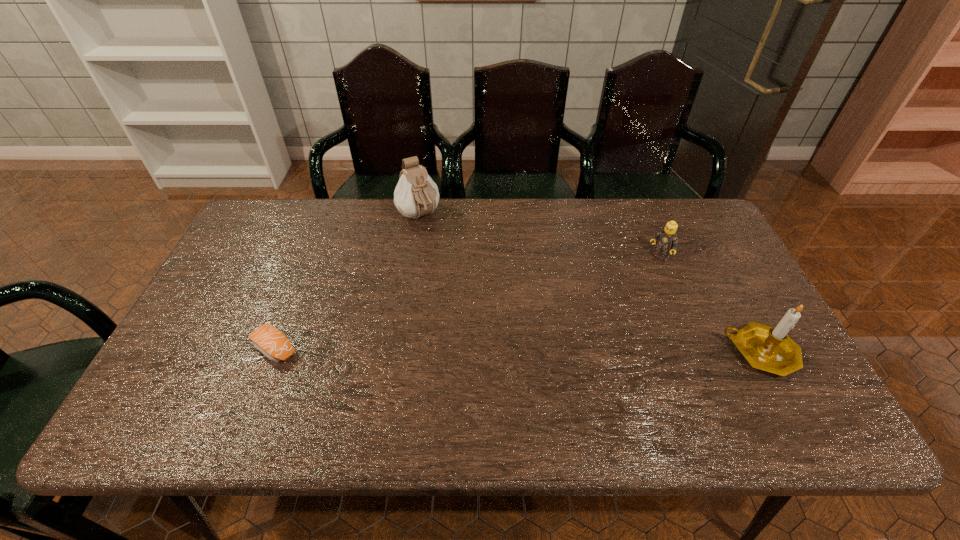
Locate an element on the screen. This screenshot has height=540, width=960. free space in the image that satisfies the following two spatial constraints: 1. on the front side of the second object from left to right; 2. on the left side of the second shortest object is located at coordinates tap(412, 258).